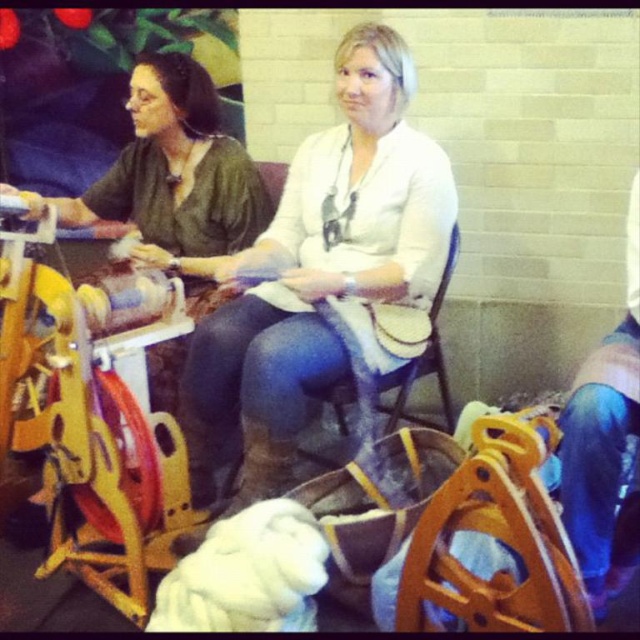
Question: Considering the real-world distances, which object is closest to the green matte fabric at left?

Choices:
 (A) white matte sweater at center
 (B) wooden chair at center

Answer: (A)

Question: Where is white matte sweater at center located in relation to wooden chair at center in the image?

Choices:
 (A) right
 (B) left

Answer: (B)

Question: Which of the following is the farthest from the observer?

Choices:
 (A) wooden chair at center
 (B) green matte fabric at left
 (C) white matte sweater at center

Answer: (B)

Question: From the image, what is the correct spatial relationship of green matte fabric at left in relation to wooden chair at center?

Choices:
 (A) above
 (B) below

Answer: (A)

Question: Does green matte fabric at left have a lesser width compared to wooden chair at center?

Choices:
 (A) no
 (B) yes

Answer: (A)

Question: Which object is positioned farthest from the green matte fabric at left?

Choices:
 (A) wooden chair at center
 (B) white matte sweater at center

Answer: (A)